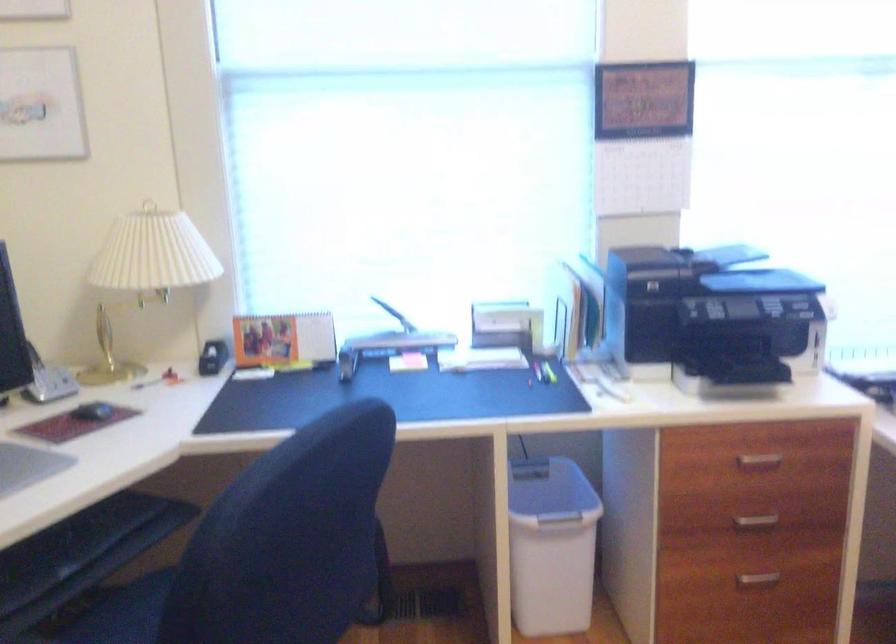
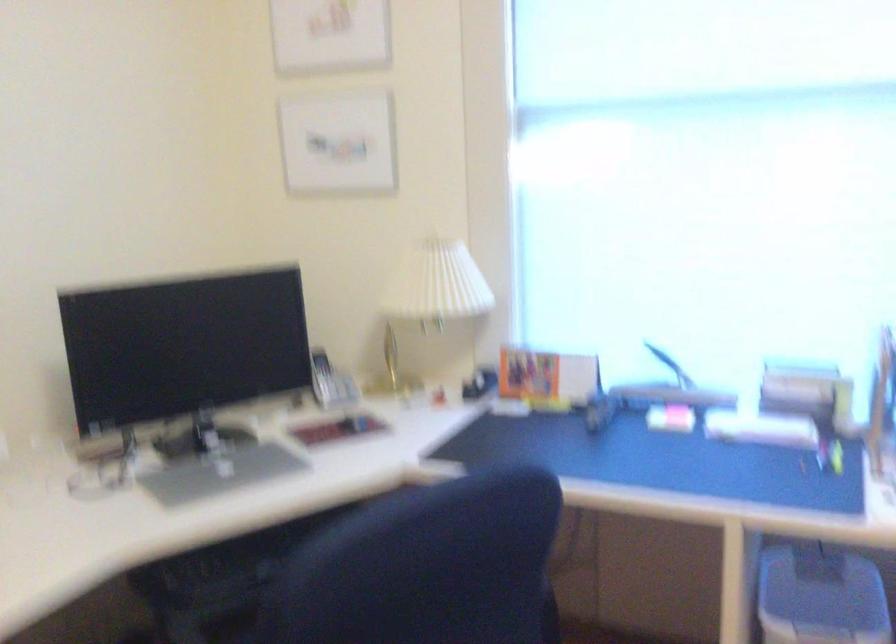
Where in the second image is the point corresponding to (x=164, y=268) from the first image?

(433, 295)